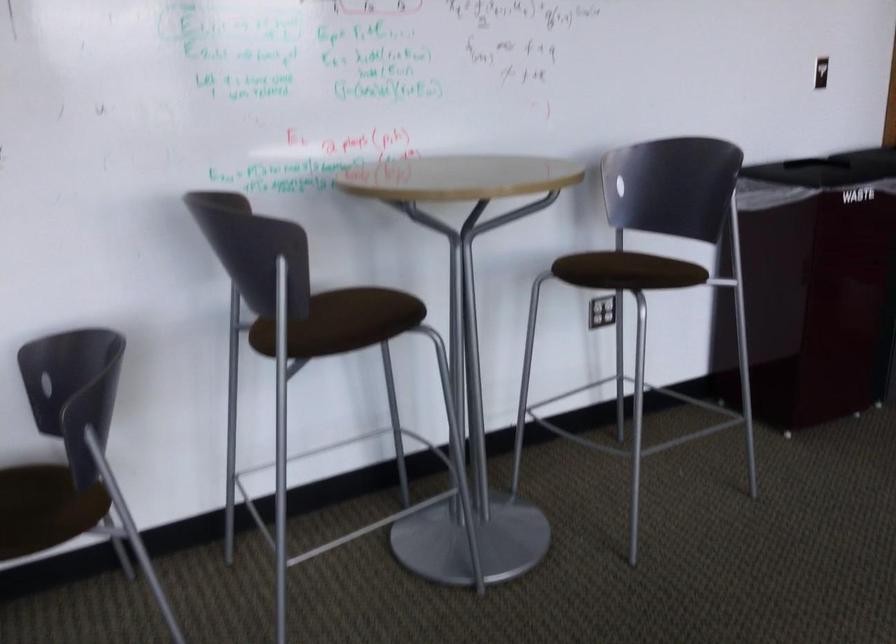
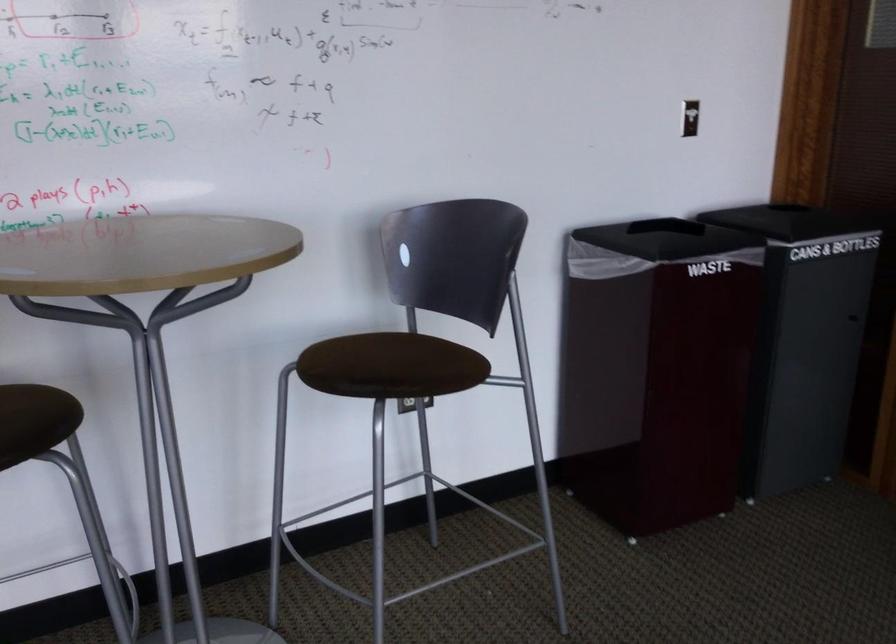
Find the pixel in the second image that matches point 389,303 in the first image.

(36, 415)